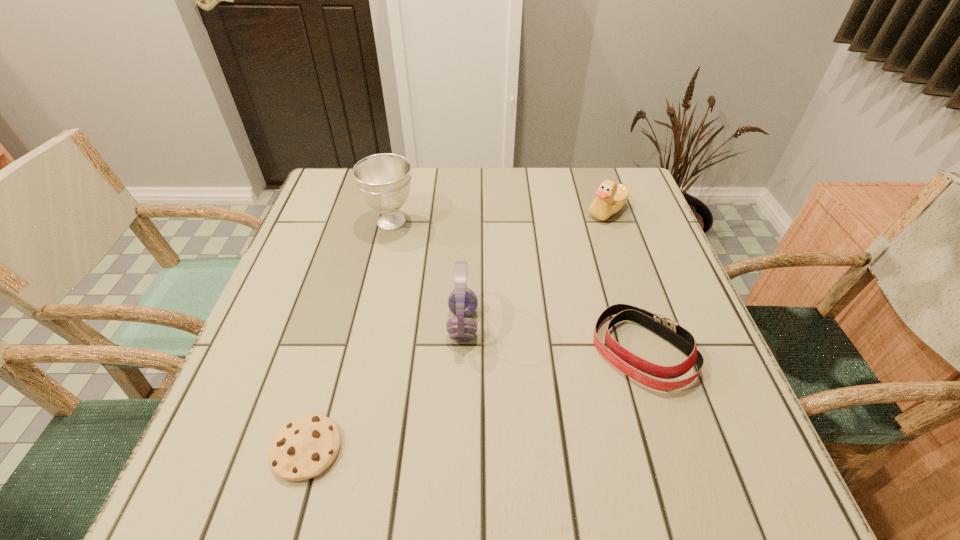
Where is `free point that satisfies the following two spatial constraints: 1. at the beak of the third tallest object; 2. on the front side of the shortest object`? free point that satisfies the following two spatial constraints: 1. at the beak of the third tallest object; 2. on the front side of the shortest object is located at coordinates (686, 449).

This screenshot has height=540, width=960. In order to click on free location that satisfies the following two spatial constraints: 1. at the beak of the third tallest object; 2. on the front side of the shortest object in this screenshot , I will do `click(686, 449)`.

Identify the location of vacant space that satisfies the following two spatial constraints: 1. on the back side of the chalice; 2. on the right side of the shortest object. This screenshot has width=960, height=540. (372, 221).

This screenshot has width=960, height=540. What are the coordinates of `blank area in the image that satisfies the following two spatial constraints: 1. on the headband and ear cups of the second shortest object; 2. on the left side of the headset` in the screenshot? It's located at (462, 351).